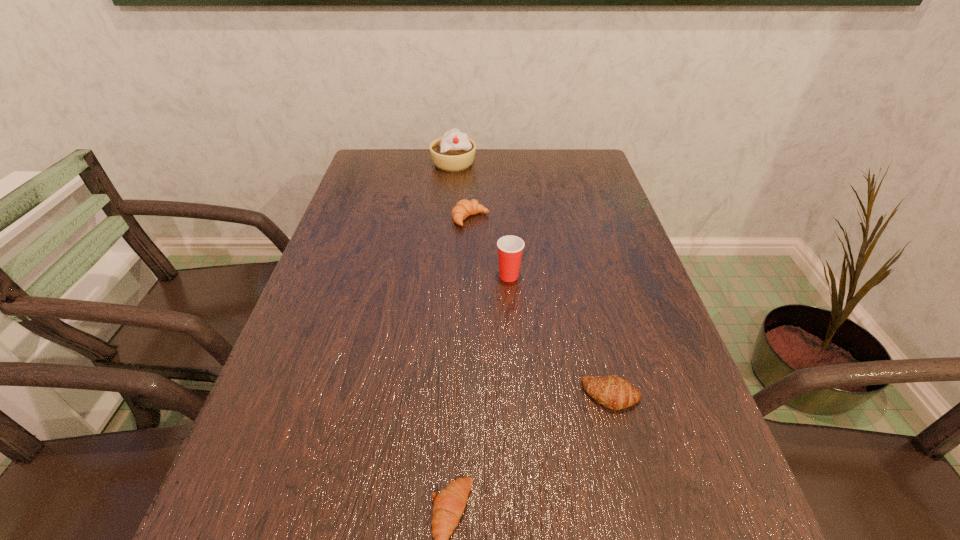
Find the location of `vacant space that is in between the fourth nearest object and the fourth object from left to right`. vacant space that is in between the fourth nearest object and the fourth object from left to right is located at coordinates (490, 247).

Identify the location of vacant space in between the fourth object from left to right and the second nearest object. The image size is (960, 540). [x=561, y=335].

Locate which object is the closest to the Dixie cup. Please provide its 2D coordinates. Your answer should be formatted as a tuple, i.e. [(x, y)], where the tuple contains the x and y coordinates of a point satisfying the conditions above.

[(464, 208)]

Image resolution: width=960 pixels, height=540 pixels. I want to click on the closest object to the farthest object, so click(464, 208).

Select which crescent roll is the second closest to the second nearest crescent roll. Please provide its 2D coordinates. Your answer should be formatted as a tuple, i.e. [(x, y)], where the tuple contains the x and y coordinates of a point satisfying the conditions above.

[(464, 208)]

Where is `crescent roll that is the closest to the rightmost object`? This screenshot has width=960, height=540. crescent roll that is the closest to the rightmost object is located at coordinates (449, 504).